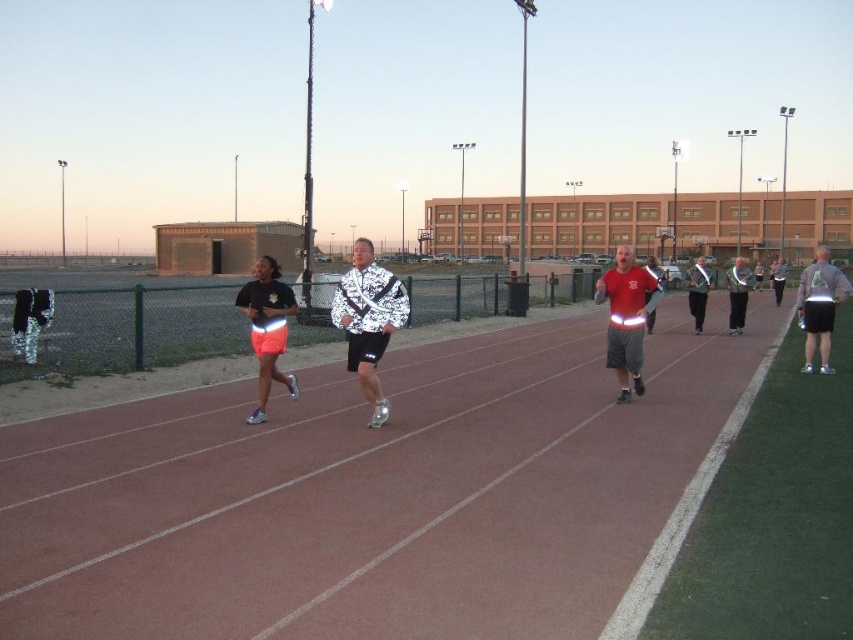
You are a photographer standing at the starting line of the track and want to capture a runner wearing the white shiny jacket at center. According to the coordinates provided, in which direction should you point your camera to locate the jacket?

The white shiny jacket at center is located at coordinates point (x=368, y=321). Since the photographer is at the starting line, they should point their camera towards the center of the track to capture the jacket.

You are a photographer trying to capture a runner wearing a white shiny jacket at center and a runner wearing a reflective silver jacket at center. Which jacket appears narrower in the photo?

The white shiny jacket at center appears narrower because it has a lesser width compared to the reflective silver jacket at center.

You are a photographer positioned at the starting line of the track. You want to capture a photo that includes both the white shiny jacket at center and the reflective silver jacket at right. Given that your camera has a maximum focus range of 45 feet, will you be able to include both subjects in the same frame without moving your position?

The white shiny jacket at center and reflective silver jacket at right are 44.77 feet apart. Since your camera can focus up to 45 feet, you can include both subjects in the same frame without moving.